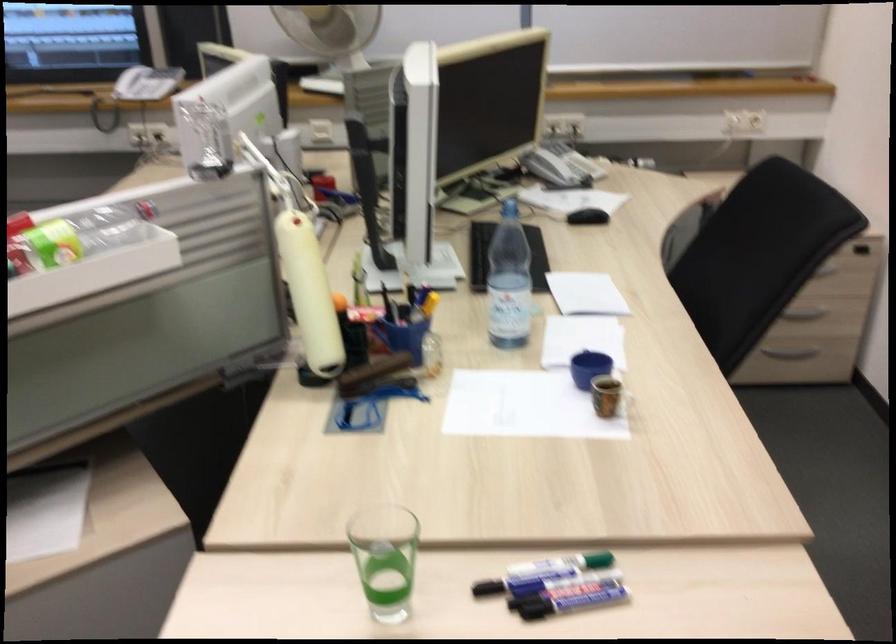
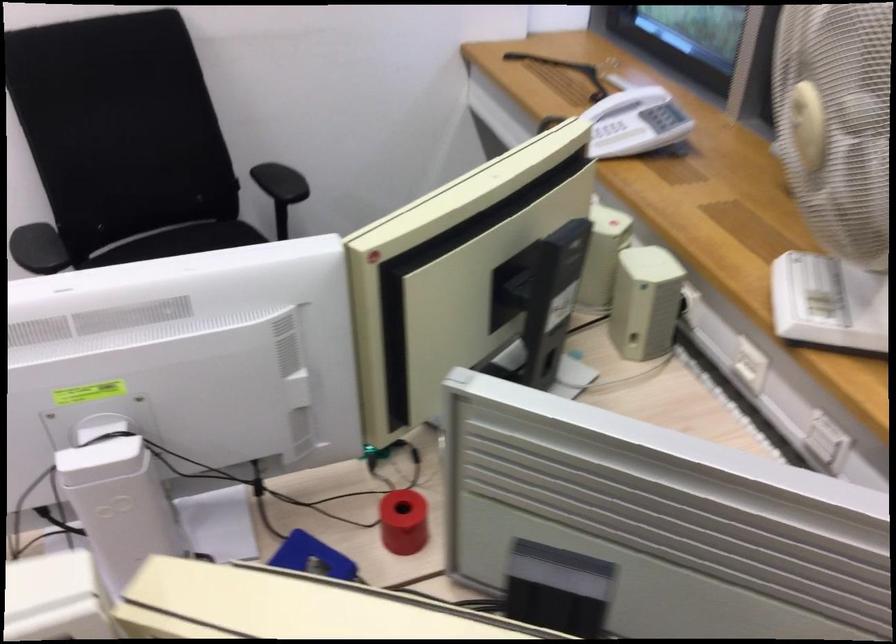
In the second image, find the point that corresponds to (288,118) in the first image.

(644, 301)